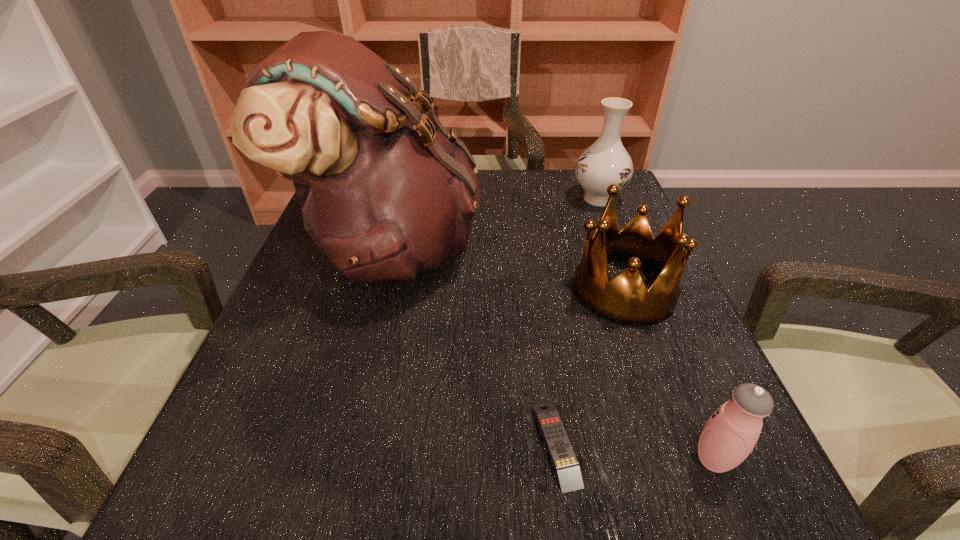
The height and width of the screenshot is (540, 960). What are the coordinates of `vacant space located on the back of the second shortest object` in the screenshot? It's located at (640, 284).

This screenshot has width=960, height=540. What are the coordinates of `free space located 0.320m on the left of the second object from left to right` in the screenshot? It's located at tap(312, 444).

The image size is (960, 540). Find the location of `satchel that is at the far edge`. satchel that is at the far edge is located at coordinates (386, 193).

The image size is (960, 540). In order to click on vase present at the far edge in this screenshot , I will do `click(606, 161)`.

Locate an element on the screen. Image resolution: width=960 pixels, height=540 pixels. thermos bottle that is at the near edge is located at coordinates (730, 434).

Find the location of `remote control at the near edge`. remote control at the near edge is located at coordinates (565, 463).

This screenshot has height=540, width=960. Identify the location of object at the left edge. (386, 193).

Where is `vase that is at the right edge`? This screenshot has height=540, width=960. vase that is at the right edge is located at coordinates (606, 161).

Where is `crown positioned at the right edge`? crown positioned at the right edge is located at coordinates [624, 300].

At what (x,y) coordinates should I click in order to perform the action: click on thermos bottle positioned at the right edge. Please return your answer as a coordinate pair (x, y). This screenshot has height=540, width=960. Looking at the image, I should click on (730, 434).